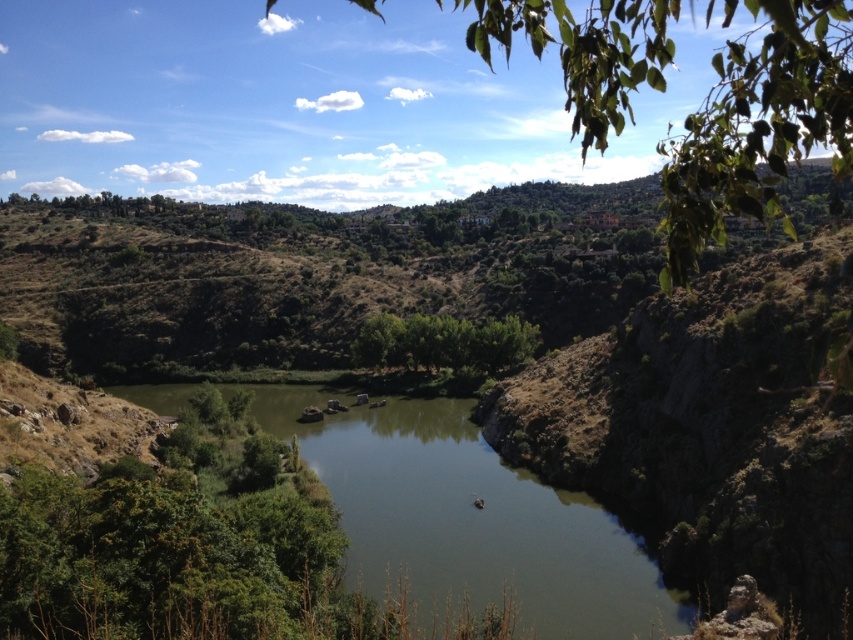
Is green leafy tree at upper center closer to camera compared to green leafy trees at center?

Yes, green leafy tree at upper center is closer to the viewer.

Between point (825, 92) and point (404, 332), which one is positioned behind?

The point (404, 332) is behind.

Where is `green leafy tree at upper center`? The width and height of the screenshot is (853, 640). green leafy tree at upper center is located at coordinates (758, 125).

Does greenish water at center have a greater width compared to green leafy trees at center?

Indeed, greenish water at center has a greater width compared to green leafy trees at center.

Is greenish water at center closer to camera compared to green leafy trees at center?

Yes, it is.

The image size is (853, 640). What do you see at coordinates (469, 520) in the screenshot? I see `greenish water at center` at bounding box center [469, 520].

Image resolution: width=853 pixels, height=640 pixels. I want to click on greenish water at center, so click(469, 520).

Which is below, greenish water at center or green leafy tree at upper center?

Positioned lower is greenish water at center.

Is greenish water at center bigger than green leafy tree at upper center?

No.

Locate an element on the screen. Image resolution: width=853 pixels, height=640 pixels. greenish water at center is located at coordinates (469, 520).